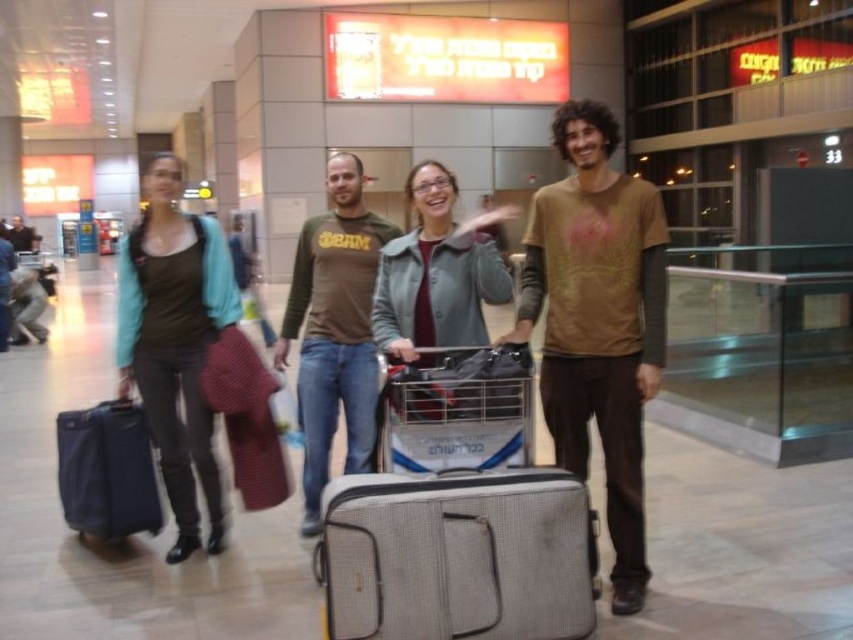
You are a traveler at the airport terminal with a heavy load. You see the gray fabric suitcase at center and the matte blue suitcase at left. Which one is easier to reach without moving the other?

The gray fabric suitcase at center is easier to reach because it is positioned under the matte blue suitcase at left, meaning it is lower and accessible without disturbing the upper one.

You are a traveler at the airport terminal. You see the brown cotton shirt at center and the matte blue suitcase at left. Which object is positioned higher from the ground?

The brown cotton shirt at center is located above the matte blue suitcase at left, so it is positioned higher from the ground.

You are at an airport terminal and need to locate your gray fabric suitcase at center. The terminal has a checkered floor pattern. If you are standing at point A, which is at coordinate point (x=457, y=556), can you confirm if you are already standing on your suitcase?

The point at coordinate (x=457, y=556) indicates the location of the gray fabric suitcase at center. Therefore, if you are standing at that coordinate, you are indeed standing on your gray fabric suitcase at center.